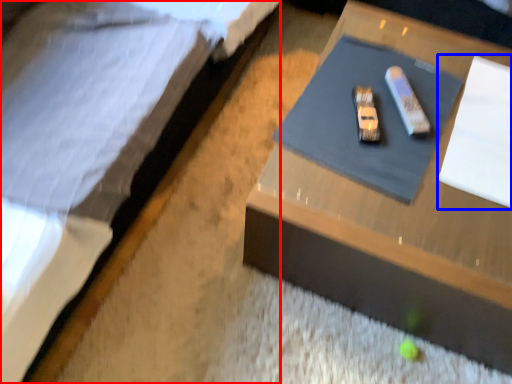
Question: Among these objects, which one is farthest to the camera, bed (highlighted by a red box) or notepad (highlighted by a blue box)?

Choices:
 (A) bed
 (B) notepad

Answer: (B)